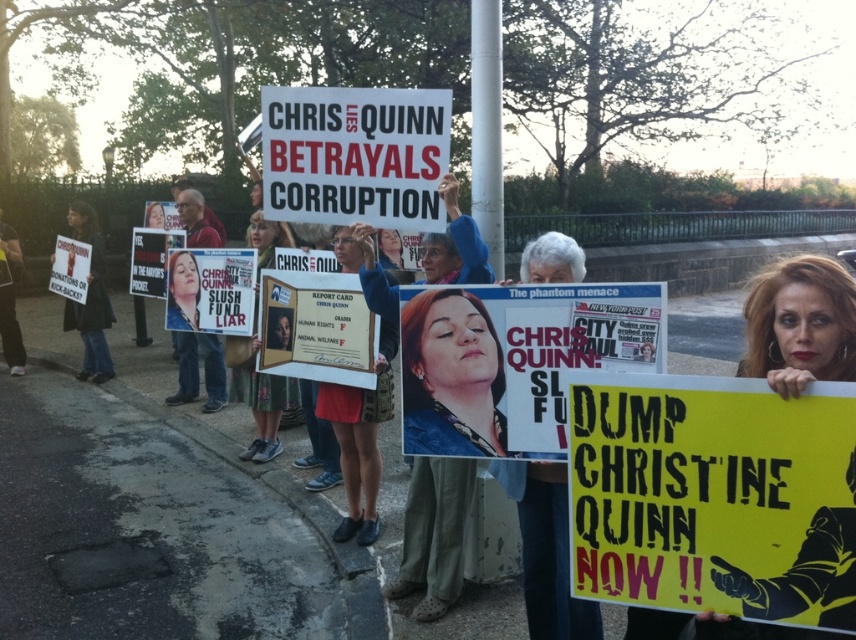
Looking at this image, you are a photographer at the protest scene. You want to take a photo that includes both the matte blue shirt at center and the black fabric jacket at left. Which object should you focus on first to ensure both are in frame?

The matte blue shirt at center is shorter than the black fabric jacket at left, so you should focus on the black fabric jacket at left first to ensure both are in frame.

You are a photographer at the protest. You need to capture a clear photo of both the matte plastic sign at center and the wooden plaque at center. Which object should you focus on first to ensure depth of field captures both?

The matte plastic sign at center is thinner than the wooden plaque at center, so focusing on the wooden plaque at center first will ensure the thinner sign remains in focus due to the depth of field extending further backward.

You are a photographer trying to capture a clear photo of the matte yellow sign at center without the yellow paper sign at lower right blocking it. Based on their positions, is this possible?

The yellow paper sign at lower right is in front of the matte yellow sign at center, so it would block the view. To capture the matte yellow sign at center clearly, you need to move to a position where the yellow paper sign at lower right is not in front of it.